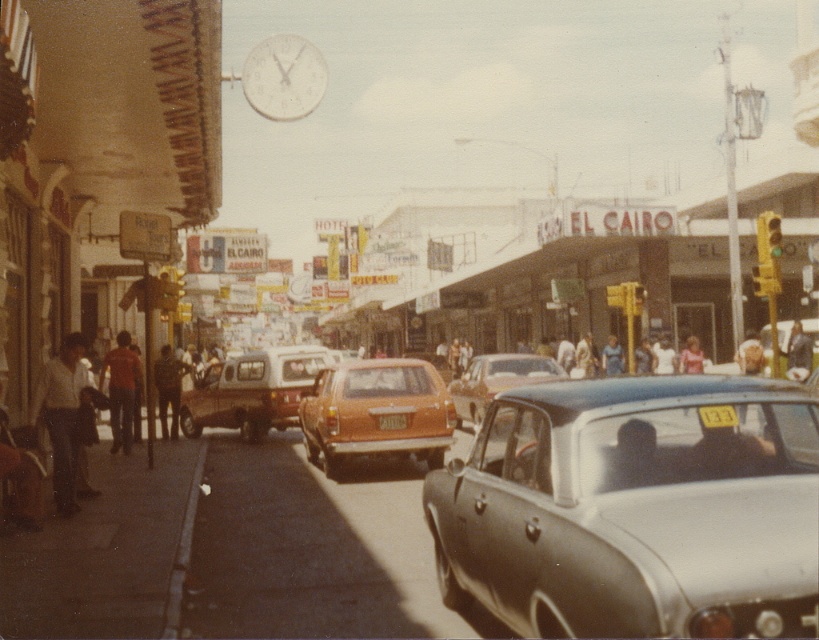
Does orange shirt at left have a lesser width compared to light pink fabric at center?

Correct, orange shirt at left's width is less than light pink fabric at center's.

Can you confirm if orange shirt at left is positioned above light pink fabric at center?

Incorrect, orange shirt at left is not positioned above light pink fabric at center.

Find the location of a particular element. Image resolution: width=819 pixels, height=640 pixels. orange shirt at left is located at coordinates (121, 390).

Where is `orange shirt at left`? The width and height of the screenshot is (819, 640). orange shirt at left is located at coordinates (121, 390).

Who is more forward, (351,362) or (70,499)?

Point (70,499) is more forward.

Who is lower down, orange matte station wagon at center or white shirt at left?

orange matte station wagon at center

Describe the element at coordinates (376, 412) in the screenshot. I see `orange matte station wagon at center` at that location.

This screenshot has width=819, height=640. I want to click on orange matte station wagon at center, so click(376, 412).

Does orange matte station wagon at center appear on the right side of dark blue shirt at center?

In fact, orange matte station wagon at center is to the left of dark blue shirt at center.

At what (x,y) coordinates should I click in order to perform the action: click on orange matte station wagon at center. Please return your answer as a coordinate pair (x, y). The width and height of the screenshot is (819, 640). Looking at the image, I should click on (376, 412).

Who is more distant from viewer, (385, 413) or (802, 348)?

Point (802, 348)

Locate an element on the screen. This screenshot has height=640, width=819. orange matte station wagon at center is located at coordinates (376, 412).